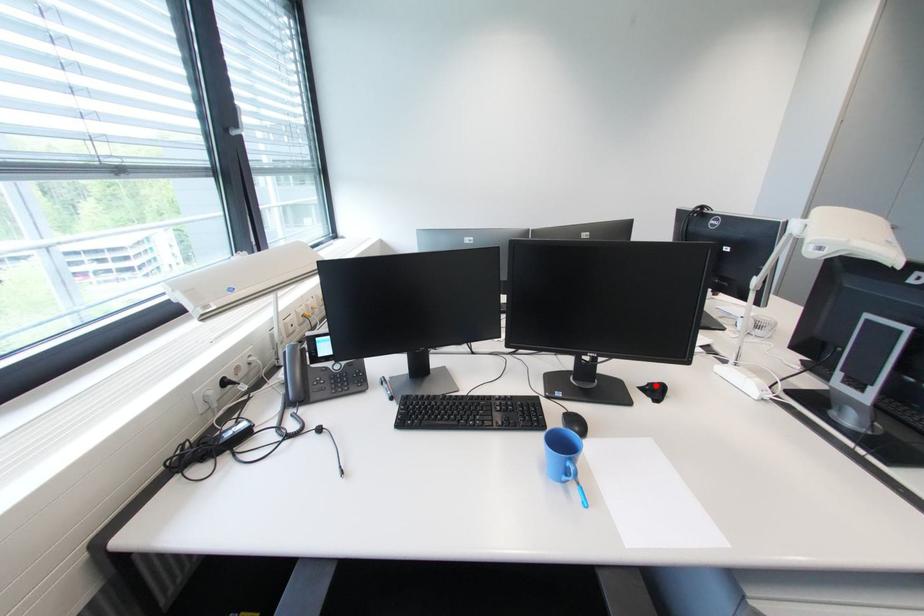
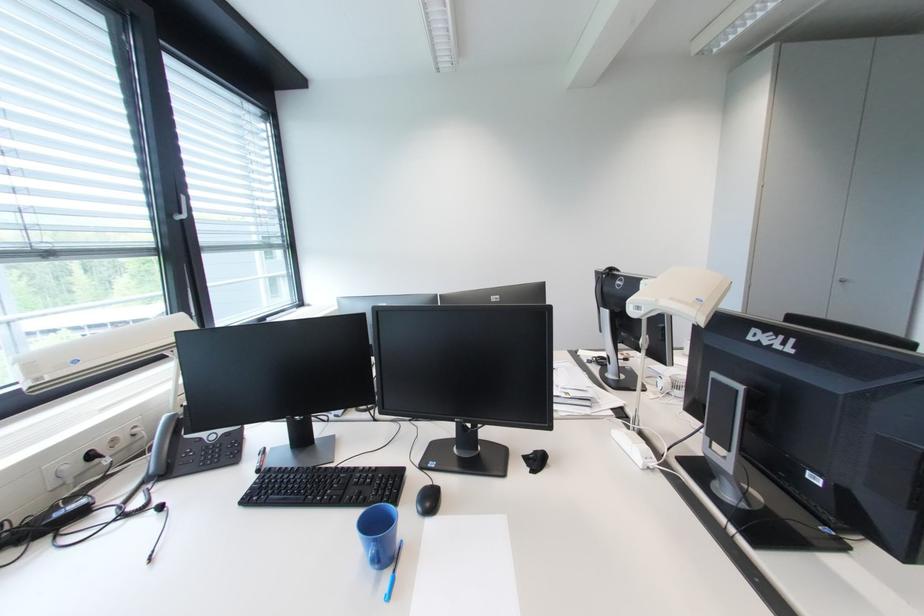
The point at the highlighted location is marked in the first image. Where is the corresponding point in the second image?

(541, 454)